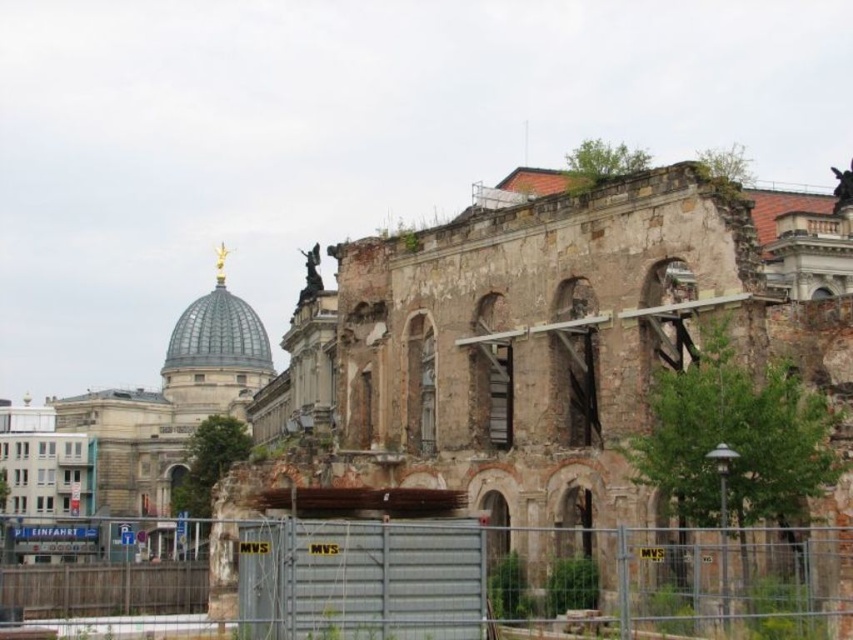
Which of these two, weathered stone ruins at center or metallic gray fence at center, stands shorter?

With less height is metallic gray fence at center.

Is weathered stone ruins at center positioned in front of metallic gray fence at center?

No.

Is point (393, 298) positioned before point (97, 612)?

No.

Identify the location of weathered stone ruins at center. The width and height of the screenshot is (853, 640). (540, 346).